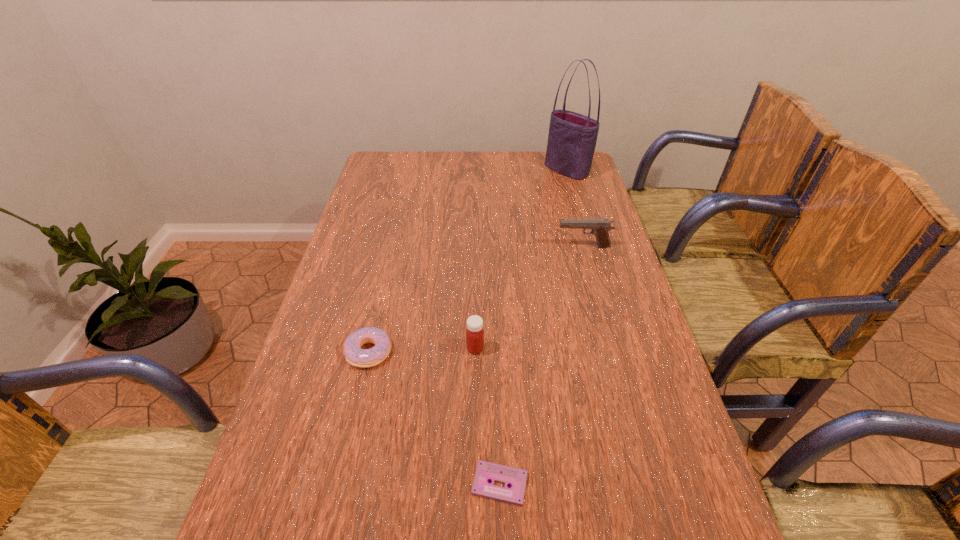
At what (x,y) coordinates should I click in order to perform the action: click on tote bag. Please return your answer as a coordinate pair (x, y). The height and width of the screenshot is (540, 960). Looking at the image, I should click on (572, 137).

The width and height of the screenshot is (960, 540). What are the coordinates of `the farthest object` in the screenshot? It's located at (572, 137).

The height and width of the screenshot is (540, 960). In order to click on pistol in this screenshot , I will do `click(599, 227)`.

At what (x,y) coordinates should I click in order to perform the action: click on medicine. Please return your answer as a coordinate pair (x, y). Looking at the image, I should click on (474, 333).

The height and width of the screenshot is (540, 960). I want to click on doughnut, so click(x=356, y=356).

This screenshot has width=960, height=540. What are the coordinates of `the leftmost object` in the screenshot? It's located at (356, 356).

Where is `the shortest object`? The height and width of the screenshot is (540, 960). the shortest object is located at coordinates (486, 471).

The image size is (960, 540). In order to click on videotape in this screenshot , I will do `click(486, 471)`.

This screenshot has height=540, width=960. I want to click on vacant space situated on the front of the farthest object, so click(581, 219).

Identify the location of vacant area located 0.380m at the barrel of the pistol. The width and height of the screenshot is (960, 540). (432, 247).